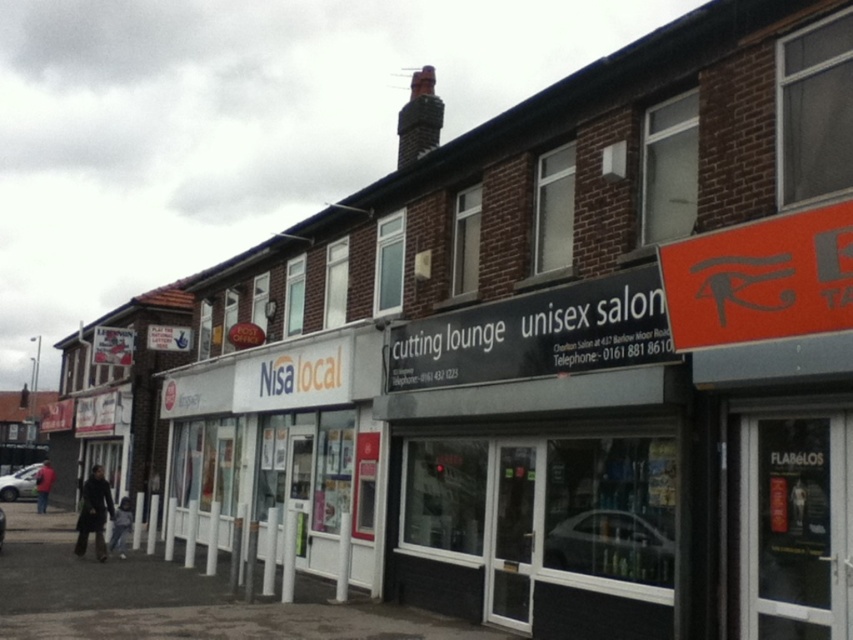
Which of these two, orange matte sign at upper right or dark gray hoodie at lower left, stands shorter?

Standing shorter between the two is dark gray hoodie at lower left.

Who is lower down, orange matte sign at upper right or dark gray hoodie at lower left?

dark gray hoodie at lower left

The height and width of the screenshot is (640, 853). I want to click on orange matte sign at upper right, so click(759, 280).

I want to click on orange matte sign at upper right, so click(x=759, y=280).

In the scene shown: Which is below, black plastic sign at center or dark gray hoodie at lower left?

dark gray hoodie at lower left

Which is in front, point (463, 333) or point (114, 532)?

Point (463, 333) is in front.

At what (x,y) coordinates should I click in order to perform the action: click on black plastic sign at center. Please return your answer as a coordinate pair (x, y). Looking at the image, I should click on (537, 333).

Where is `black plastic sign at center`? black plastic sign at center is located at coordinates (537, 333).

How far apart are black plastic sign at center and orange matte sign at upper right?

black plastic sign at center and orange matte sign at upper right are 1.44 meters apart from each other.

What do you see at coordinates (537, 333) in the screenshot? I see `black plastic sign at center` at bounding box center [537, 333].

This screenshot has width=853, height=640. Identify the location of black plastic sign at center. (537, 333).